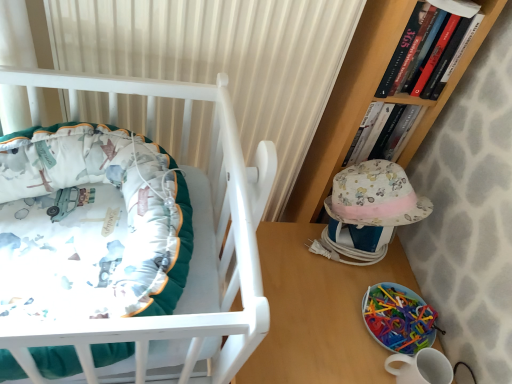
Question: Is translucent plastic toy at lower right positioned beyond the bounds of wooden table at lower right?

Choices:
 (A) yes
 (B) no

Answer: (B)

Question: From a real-world perspective, is translucent plastic toy at lower right under wooden table at lower right?

Choices:
 (A) yes
 (B) no

Answer: (B)

Question: Is wooden table at lower right located within translucent plastic toy at lower right?

Choices:
 (A) yes
 (B) no

Answer: (B)

Question: Is the depth of translucent plastic toy at lower right less than that of wooden table at lower right?

Choices:
 (A) no
 (B) yes

Answer: (A)

Question: From the image's perspective, is translucent plastic toy at lower right located beneath wooden table at lower right?

Choices:
 (A) no
 (B) yes

Answer: (A)

Question: Do you think hardcover book at upper right, which is counted as the first book, starting from the back, is within wooden table at lower right, or outside of it?

Choices:
 (A) inside
 (B) outside

Answer: (B)

Question: Is hardcover book at upper right, which is counted as the first book, starting from the back, taller or shorter than wooden table at lower right?

Choices:
 (A) short
 (B) tall

Answer: (A)

Question: From the image's perspective, is hardcover book at upper right, the 2th book viewed from the front, positioned above or below wooden table at lower right?

Choices:
 (A) below
 (B) above

Answer: (B)

Question: Considering the positions of hardcover book at upper right, which is counted as the first book, starting from the back, and wooden table at lower right in the image, is hardcover book at upper right, which is counted as the first book, starting from the back, bigger or smaller than wooden table at lower right?

Choices:
 (A) big
 (B) small

Answer: (B)

Question: Do you think translucent plastic toy at lower right is within hardcover book at upper right, which is counted as the first book, starting from the back, or outside of it?

Choices:
 (A) outside
 (B) inside

Answer: (A)

Question: Considering the positions of translucent plastic toy at lower right and hardcover book at upper right, the 2th book viewed from the front, in the image, is translucent plastic toy at lower right taller or shorter than hardcover book at upper right, the 2th book viewed from the front,?

Choices:
 (A) tall
 (B) short

Answer: (B)

Question: From a real-world perspective, is translucent plastic toy at lower right physically located above or below hardcover book at upper right, the 2th book viewed from the front?

Choices:
 (A) above
 (B) below

Answer: (B)

Question: Considering the relative positions of translucent plastic toy at lower right and hardcover book at upper right, which is counted as the first book, starting from the back, in the image provided, is translucent plastic toy at lower right to the left or to the right of hardcover book at upper right, which is counted as the first book, starting from the back,?

Choices:
 (A) left
 (B) right

Answer: (B)

Question: Is point 346,302 positioned closer to the camera than point 402,344?

Choices:
 (A) farther
 (B) closer

Answer: (A)

Question: Is wooden table at lower right wider or thinner than translucent plastic toy at lower right?

Choices:
 (A) thin
 (B) wide

Answer: (B)